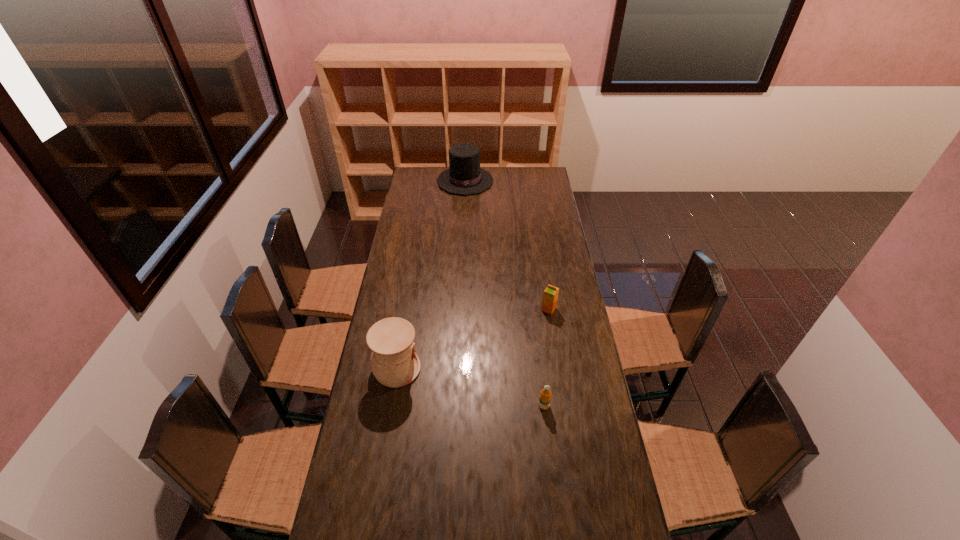
The image size is (960, 540). In order to click on the farthest object in this screenshot , I will do `click(464, 177)`.

Identify the location of the second nearest object. The width and height of the screenshot is (960, 540). (394, 362).

Where is `the right orange juice`? This screenshot has width=960, height=540. the right orange juice is located at coordinates (550, 296).

Identify the location of the farther orange juice. click(550, 296).

Locate an element on the screen. The image size is (960, 540). the second object from right to left is located at coordinates (545, 397).

At what (x,y) coordinates should I click in order to perform the action: click on the shortest object. Please return your answer as a coordinate pair (x, y). The height and width of the screenshot is (540, 960). Looking at the image, I should click on (545, 397).

Identify the location of vacant space located 0.070m on the front of the dress hat with the decoration. This screenshot has width=960, height=540. (464, 204).

The width and height of the screenshot is (960, 540). Find the location of `free region located at the open side of the pottery`. free region located at the open side of the pottery is located at coordinates click(x=456, y=369).

Locate an element on the screen. The width and height of the screenshot is (960, 540). vacant point located on the back of the rightmost object is located at coordinates (546, 295).

This screenshot has width=960, height=540. I want to click on blank space located on the label of the shorter orange juice, so click(x=558, y=524).